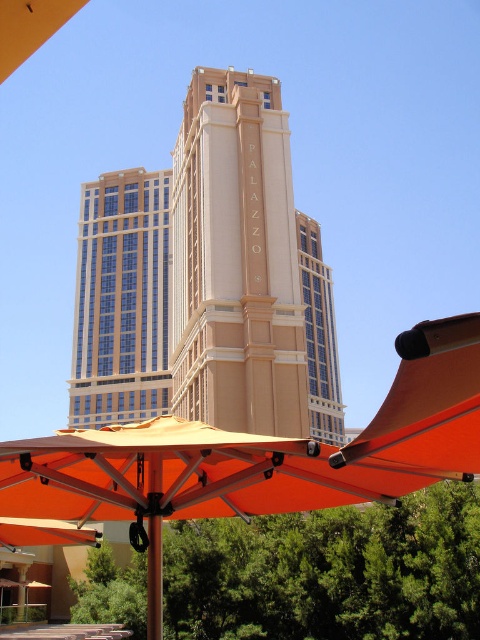
You are a visitor standing at the entrance of the building. You want to sit under the orange fabric umbrella at lower center while still being able to see the beige stone tower at center. Is the umbrella positioned in a way that allows you to see the tower without moving your head?

The orange fabric umbrella at lower center is to the right of the beige stone tower at center, so if you sit under the umbrella, you can see the tower to your left without moving your head.

You are standing in front of the modern building with the word PALAZZO. There are two points marked on the image. Which point is closer to you, point (415, 432) or point (249, 381)?

Point (415, 432) is closer to the viewer than point (249, 381).

You are a painter standing at the base of the beige stone tower at center, and you want to paint the orange fabric umbrella at lower center. Since you are at the base of the tower, will you be able to see the entire umbrella without any obstruction from the tower?

The orange fabric umbrella at lower center has a lesser height compared to beige stone tower at center. Since the umbrella is shorter than the tower, you will be able to see the entire umbrella without obstruction from the tower as long as there are no other objects blocking your view.